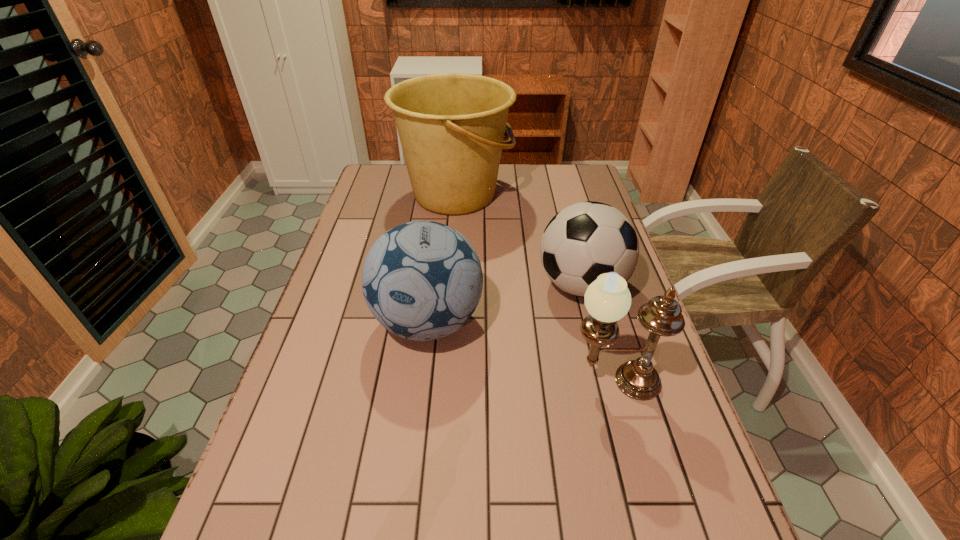
Where is `bucket`? The height and width of the screenshot is (540, 960). bucket is located at coordinates (451, 126).

In order to click on oil lamp in this screenshot , I will do `click(607, 299)`.

I want to click on the left soccer ball, so click(x=422, y=280).

The width and height of the screenshot is (960, 540). Identify the location of the right soccer ball. (584, 240).

I want to click on vacant space located on the side of the farthest object with the handle, so click(570, 195).

Locate an element on the screen. The image size is (960, 540). vacant space located on the left of the oil lamp is located at coordinates (420, 382).

Where is `vacant point located 0.230m on the side with brand of the left soccer ball`? vacant point located 0.230m on the side with brand of the left soccer ball is located at coordinates click(411, 460).

Image resolution: width=960 pixels, height=540 pixels. Identify the location of free space located 0.080m on the left of the right soccer ball. (509, 286).

This screenshot has height=540, width=960. In order to click on object located in the far edge section of the desktop in this screenshot , I will do `click(451, 126)`.

Where is `bucket at the left edge`? This screenshot has width=960, height=540. bucket at the left edge is located at coordinates pos(451,126).